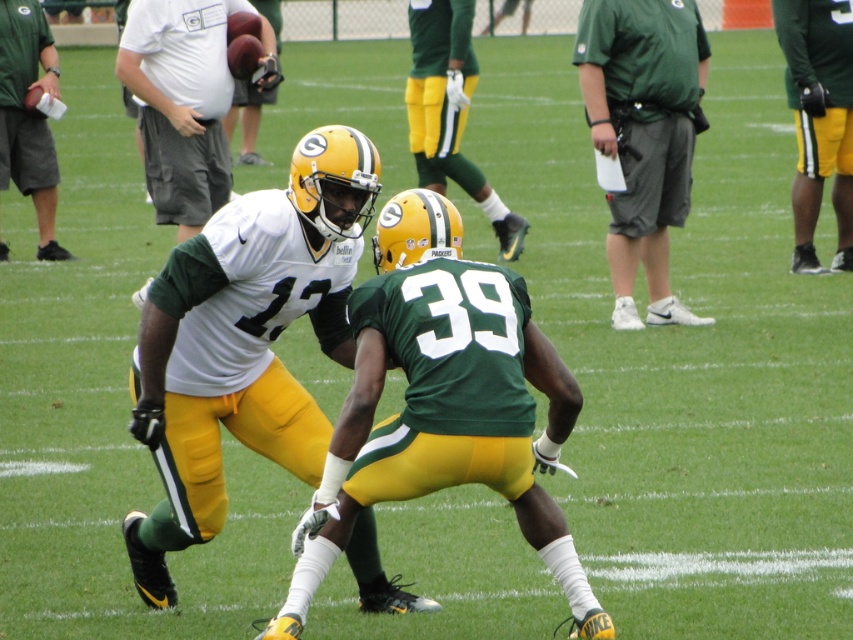
Does matte white jersey at center appear under green fabric shirt at upper center?

Indeed, matte white jersey at center is positioned under green fabric shirt at upper center.

Based on the photo, how much distance is there between matte white jersey at center and green fabric shirt at upper center?

4.73 meters

Is point (201, 532) more distant than point (666, 108)?

No, (201, 532) is in front of (666, 108).

Find the location of `matte white jersey at center`. matte white jersey at center is located at coordinates (244, 340).

Is green fabric shirt at upper center below green matte jersey at upper right?

Yes.

Which is more to the left, green fabric shirt at upper center or green matte jersey at upper right?

green fabric shirt at upper center is more to the left.

In order to click on green fabric shirt at upper center in this screenshot , I will do `click(643, 134)`.

Locate an element on the screen. The image size is (853, 640). green fabric shirt at upper center is located at coordinates (643, 134).

How distant is matte white clipboard at left from matte black football at upper left?

They are 4.36 meters apart.

What do you see at coordinates (28, 115) in the screenshot? I see `matte white clipboard at left` at bounding box center [28, 115].

Locate an element on the screen. The image size is (853, 640). matte white clipboard at left is located at coordinates (28, 115).